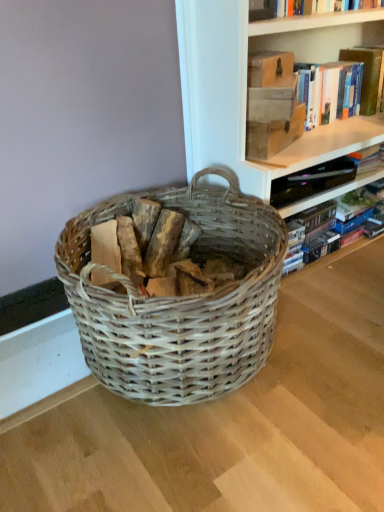
How much space does matte brown book at upper right, the second paperback book in the top-to-bottom sequence, occupy horizontally?

It is 7.96 inches.

Where is `hardcover book at upper right, placed as the first book when sorted from bottom to top`? The height and width of the screenshot is (512, 384). hardcover book at upper right, placed as the first book when sorted from bottom to top is located at coordinates (328, 225).

Describe the element at coordinates (328, 225) in the screenshot. This screenshot has width=384, height=512. I see `hardcover book at upper right, placed as the first book when sorted from bottom to top` at that location.

Where is `woven wood basket at center`? This screenshot has width=384, height=512. woven wood basket at center is located at coordinates (180, 300).

The height and width of the screenshot is (512, 384). Describe the element at coordinates (159, 252) in the screenshot. I see `wooden logs at center` at that location.

This screenshot has height=512, width=384. Identify the location of matte brown book at upper center, the second paperback book from the bottom. (269, 68).

Does woven wood basket at center have a greater width compared to hardcover book at upper right, which is counted as the second book, starting from the bottom?

Correct, the width of woven wood basket at center exceeds that of hardcover book at upper right, which is counted as the second book, starting from the bottom.

Is woven wood basket at center taller or shorter than hardcover book at upper right, which is counted as the second book, starting from the bottom?

In the image, woven wood basket at center appears to be taller than hardcover book at upper right, which is counted as the second book, starting from the bottom.

Does hardcover book at upper right, placed as the first book when sorted from bottom to top, have a smaller size compared to matte brown book at upper center, the second paperback book from the bottom?

No, hardcover book at upper right, placed as the first book when sorted from bottom to top, is not smaller than matte brown book at upper center, the second paperback book from the bottom.

From a real-world perspective, relative to matte brown book at upper center, the second paperback book from the bottom, is hardcover book at upper right, placed as the first book when sorted from bottom to top, vertically above or below?

hardcover book at upper right, placed as the first book when sorted from bottom to top, is below matte brown book at upper center, the second paperback book from the bottom.

Is hardcover book at upper right, placed as the first book when sorted from bottom to top, next to matte brown book at upper center, acting as the 1th paperback book starting from the top?

hardcover book at upper right, placed as the first book when sorted from bottom to top, and matte brown book at upper center, acting as the 1th paperback book starting from the top, are clearly separated.

Do you think hardcover book at upper right, which is the 2th book from top to bottom, is within matte brown book at upper center, acting as the 1th paperback book starting from the top, or outside of it?

hardcover book at upper right, which is the 2th book from top to bottom, is located beyond the bounds of matte brown book at upper center, acting as the 1th paperback book starting from the top.

Is hardcover book at upper right, which is counted as the second book, starting from the bottom, turned away from matte brown book at upper center, the second paperback book from the bottom?

hardcover book at upper right, which is counted as the second book, starting from the bottom, does not have its back to matte brown book at upper center, the second paperback book from the bottom.

Looking at the image, does hardcover book at upper right, which is counted as the second book, starting from the bottom, seem bigger or smaller compared to matte brown book at upper center, the second paperback book from the bottom?

In the image, hardcover book at upper right, which is counted as the second book, starting from the bottom, appears to be larger than matte brown book at upper center, the second paperback book from the bottom.

Considering the positions of points (297, 70) and (248, 73), is point (297, 70) farther from camera compared to point (248, 73)?

Yes, point (297, 70) is farther from viewer.

Is hardcover book at upper right, which is the 1th book from top to bottom, at the left side of matte brown book at upper center, the second paperback book from the bottom?

In fact, hardcover book at upper right, which is the 1th book from top to bottom, is to the right of matte brown book at upper center, the second paperback book from the bottom.

At what (x,y) coordinates should I click in order to perform the action: click on picnic basket lying on the left of hardcover book at upper right, placed as the first book when sorted from bottom to top. Please return your answer as a coordinate pair (x, y). The height and width of the screenshot is (512, 384). Looking at the image, I should click on (180, 300).

Is hardcover book at upper right, which is the 2th book from top to bottom, positioned with its back to woven wood basket at center?

hardcover book at upper right, which is the 2th book from top to bottom, is not turned away from woven wood basket at center.

From the picture: How many degrees apart are the facing directions of hardcover book at upper right, which is the 2th book from top to bottom, and woven wood basket at center?

The facing directions of hardcover book at upper right, which is the 2th book from top to bottom, and woven wood basket at center are 4.74 degrees apart.

Is woven wood basket at center positioned with its back to wooden logs at center?

That's right, woven wood basket at center is facing away from wooden logs at center.

Measure the distance between woven wood basket at center and wooden logs at center.

4.82 inches.

Which of these two, woven wood basket at center or wooden logs at center, is thinner?

wooden logs at center.

Would you say woven wood basket at center is a long distance from wooden logs at center?

woven wood basket at center is near wooden logs at center, not far away.

From a real-world perspective, is matte brown book at upper center, the second paperback book from the bottom, positioned under hardcover book at upper right, which is the 1th book from top to bottom, based on gravity?

No.

Is matte brown book at upper center, the second paperback book from the bottom, facing away from hardcover book at upper right, which is counted as the second book, starting from the bottom?

No.

This screenshot has height=512, width=384. I want to click on the 1st book directly beneath the matte brown book at upper center, acting as the 1th paperback book starting from the top (from a real-world perspective), so click(x=342, y=86).

Could you tell me if hardcover book at upper right, which is counted as the second book, starting from the bottom, is turned towards wooden logs at center?

No, hardcover book at upper right, which is counted as the second book, starting from the bottom, does not turn towards wooden logs at center.

From a real-world perspective, is hardcover book at upper right, which is counted as the second book, starting from the bottom, physically above wooden logs at center?

Yes, from a real-world perspective, hardcover book at upper right, which is counted as the second book, starting from the bottom, is above wooden logs at center.

Consider the image. Is hardcover book at upper right, which is the 1th book from top to bottom, shorter than wooden logs at center?

No.

Is point (366, 87) closer to camera compared to point (111, 261)?

No, it is behind (111, 261).

Where is `book that is the 2nd one when counting upward from the woven wood basket at center (from the image's perspective)`? book that is the 2nd one when counting upward from the woven wood basket at center (from the image's perspective) is located at coordinates (342, 86).

Locate an element on the screen. the 2nd paperback book in front of the hardcover book at upper right, which is the 2th book from top to bottom, counting from the anchor's position is located at coordinates (269, 68).

Considering their positions, is wooden logs at center positioned closer to hardcover book at upper right, which is the 1th book from top to bottom, than woven wood basket at center?

Among the two, woven wood basket at center is located nearer to hardcover book at upper right, which is the 1th book from top to bottom.

When comparing their distances from wooden logs at center, does hardcover book at upper right, which is counted as the second book, starting from the bottom, or hardcover book at upper right, which is the 2th book from top to bottom, seem closer?

Among the two, hardcover book at upper right, which is the 2th book from top to bottom, is located nearer to wooden logs at center.

Consider the image. When comparing their distances from hardcover book at upper right, which is counted as the second book, starting from the bottom, does hardcover book at upper right, which is the 2th book from top to bottom, or matte brown book at upper center, acting as the 1th paperback book starting from the top, seem closer?

hardcover book at upper right, which is the 2th book from top to bottom, is closer to hardcover book at upper right, which is counted as the second book, starting from the bottom.

Considering their positions, is woven wood basket at center positioned further to matte brown book at upper center, acting as the 1th paperback book starting from the top, than wooden logs at center?

The object further to matte brown book at upper center, acting as the 1th paperback book starting from the top, is woven wood basket at center.

Considering their positions, is hardcover book at upper right, which is counted as the second book, starting from the bottom, positioned closer to matte brown book at upper center, the second paperback book from the bottom, than wooden logs at center?

The object closer to matte brown book at upper center, the second paperback book from the bottom, is hardcover book at upper right, which is counted as the second book, starting from the bottom.

Based on their spatial positions, is hardcover book at upper right, which is counted as the second book, starting from the bottom, or woven wood basket at center further from wooden logs at center?

Among the two, hardcover book at upper right, which is counted as the second book, starting from the bottom, is located further to wooden logs at center.

From the image, which object appears to be farther from woven wood basket at center, matte brown book at upper center, acting as the 1th paperback book starting from the top, or matte brown book at upper right, the 1th paperback book when ordered from bottom to top?

matte brown book at upper center, acting as the 1th paperback book starting from the top, is positioned further to the anchor woven wood basket at center.

Which object lies nearer to the anchor point matte brown book at upper center, acting as the 1th paperback book starting from the top, matte brown book at upper right, the 1th paperback book when ordered from bottom to top, or hardcover book at upper right, which is counted as the second book, starting from the bottom?

matte brown book at upper right, the 1th paperback book when ordered from bottom to top, is closer to matte brown book at upper center, acting as the 1th paperback book starting from the top.

You are a GUI agent. You are given a task and a screenshot of the screen. Output one action in this format:
    pyautogui.click(x=<x>, y=<y>)
    Task: Click on the paperback book between matte brown book at upper center, the second paperback book from the bottom, and woven wood basket at center in the up-down direction
    
    Given the screenshot: What is the action you would take?
    click(273, 135)

Locate an element on the screen. debris between matte brown book at upper center, the second paperback book from the bottom, and woven wood basket at center, in the vertical direction is located at coordinates (159, 252).

Locate an element on the screen. The height and width of the screenshot is (512, 384). book situated between wooden logs at center and hardcover book at upper right, placed as the first book when sorted from bottom to top, from left to right is located at coordinates (342, 86).

Identify the location of paperback book between matte brown book at upper center, acting as the 1th paperback book starting from the top, and hardcover book at upper right, which is counted as the second book, starting from the bottom, in the horizontal direction. (273, 135).